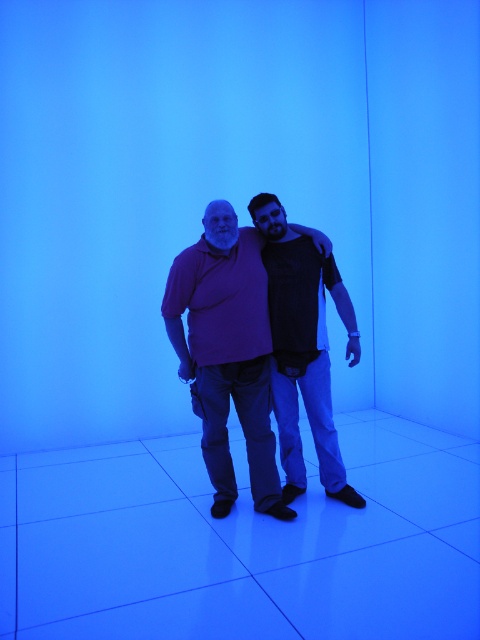
Question: Which point is farther from the camera taking this photo?

Choices:
 (A) (225, 244)
 (B) (316, 356)

Answer: (B)

Question: Is purple matte shirt at center positioned before dark gray t-shirt at center?

Choices:
 (A) yes
 (B) no

Answer: (A)

Question: Is purple matte shirt at center wider than dark gray t-shirt at center?

Choices:
 (A) no
 (B) yes

Answer: (B)

Question: Does purple matte shirt at center have a lesser width compared to dark gray t-shirt at center?

Choices:
 (A) yes
 (B) no

Answer: (B)